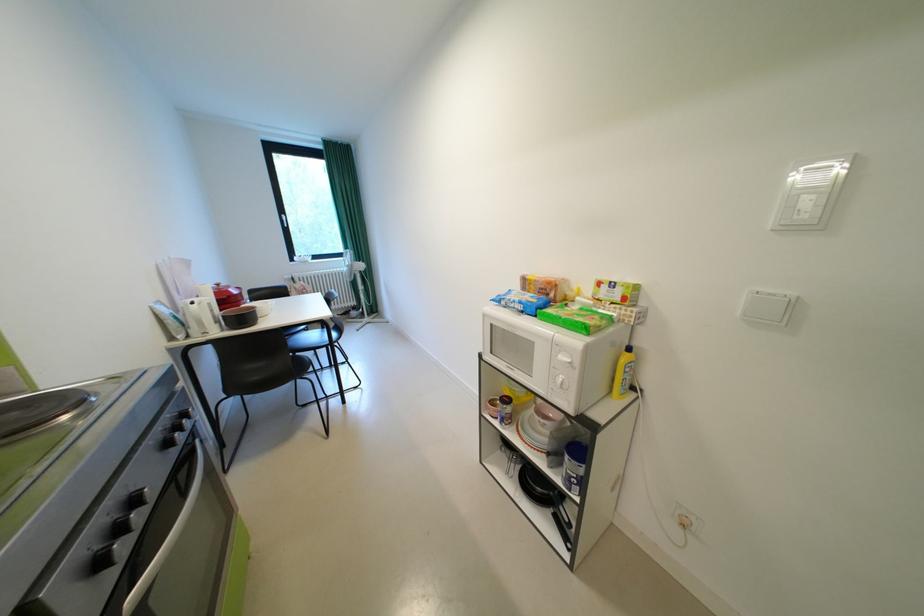
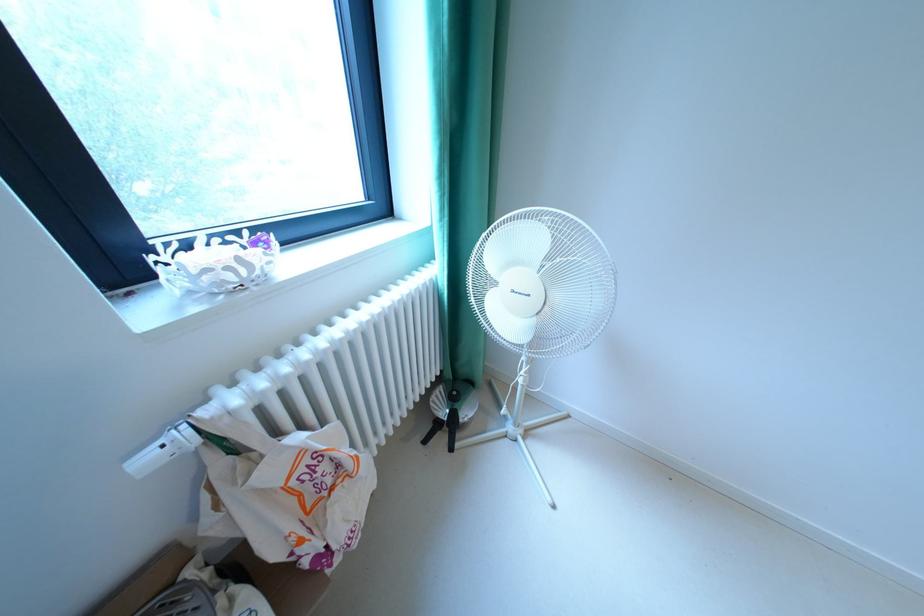
Where in the second image is the point corresponding to pixel 297 277 from the first image?

(156, 460)